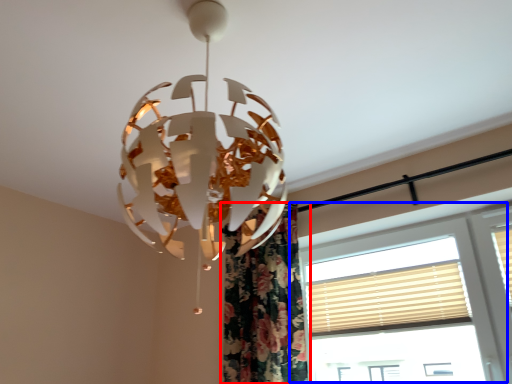
Question: Which object is closer to the camera taking this photo, curtain (highlighted by a red box) or window (highlighted by a blue box)?

Choices:
 (A) curtain
 (B) window

Answer: (B)